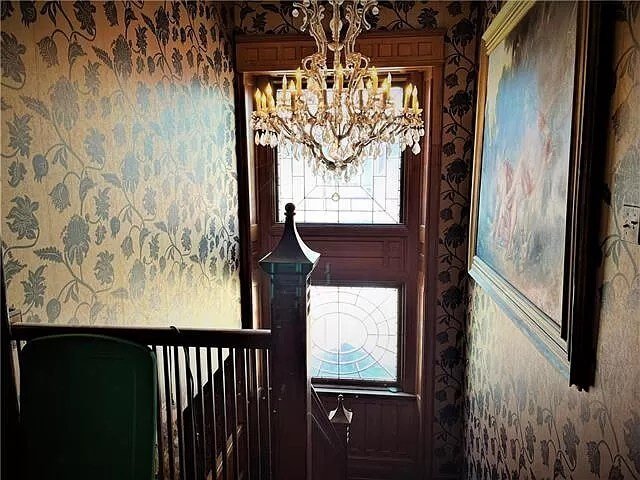
Find the location of a particular element. The height and width of the screenshot is (480, 640). right wall is located at coordinates (513, 405).